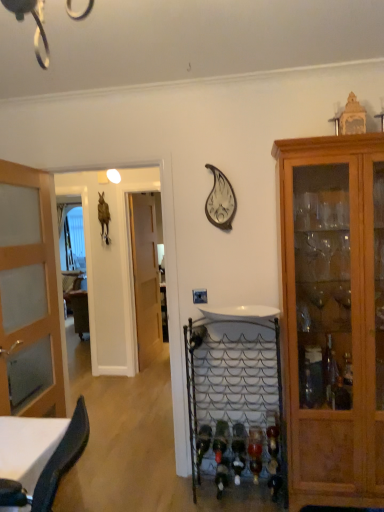
Question: Is wooden cabinet at right far away from metallic wire wine rack at center?

Choices:
 (A) yes
 (B) no

Answer: (B)

Question: Could metallic wire wine rack at center be considered to be inside wooden cabinet at right?

Choices:
 (A) yes
 (B) no

Answer: (B)

Question: From a real-world perspective, is wooden cabinet at right beneath metallic wire wine rack at center?

Choices:
 (A) no
 (B) yes

Answer: (A)

Question: Does wooden cabinet at right have a greater width compared to metallic wire wine rack at center?

Choices:
 (A) yes
 (B) no

Answer: (A)

Question: Can you confirm if wooden cabinet at right is taller than metallic wire wine rack at center?

Choices:
 (A) yes
 (B) no

Answer: (A)

Question: Considering the relative positions of wooden cabinet at right and metallic wire wine rack at center in the image provided, is wooden cabinet at right to the left of metallic wire wine rack at center from the viewer's perspective?

Choices:
 (A) no
 (B) yes

Answer: (A)

Question: Is translucent wood door at left, which is the first door from left to right, shorter than metallic silver clock at upper center?

Choices:
 (A) no
 (B) yes

Answer: (A)

Question: Is the position of translucent wood door at left, which is the first door from left to right, less distant than that of metallic silver clock at upper center?

Choices:
 (A) no
 (B) yes

Answer: (B)

Question: Is metallic silver clock at upper center completely or partially inside translucent wood door at left, which is the first door from left to right?

Choices:
 (A) no
 (B) yes

Answer: (A)

Question: Does translucent wood door at left, marked as the 1th door in a front-to-back arrangement, come behind metallic silver clock at upper center?

Choices:
 (A) yes
 (B) no

Answer: (B)

Question: Considering the relative sizes of translucent wood door at left, marked as the 1th door in a front-to-back arrangement, and metallic silver clock at upper center in the image provided, is translucent wood door at left, marked as the 1th door in a front-to-back arrangement, taller than metallic silver clock at upper center?

Choices:
 (A) yes
 (B) no

Answer: (A)

Question: Does metallic silver clock at upper center have a larger size compared to translucent wood door at left, which is the first door from left to right?

Choices:
 (A) no
 (B) yes

Answer: (A)